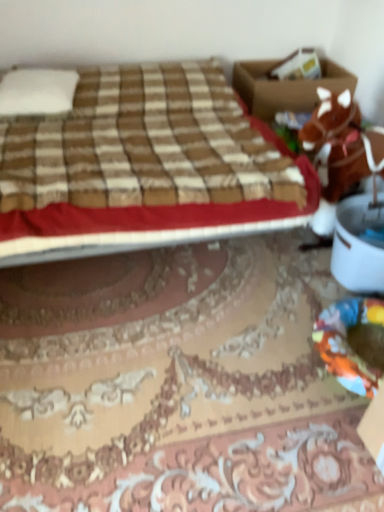
Question: Is brown plaid bed at upper left inside or outside of brown cardboard box at upper right?

Choices:
 (A) inside
 (B) outside

Answer: (B)

Question: Is brown plaid bed at upper left bigger or smaller than brown cardboard box at upper right?

Choices:
 (A) small
 (B) big

Answer: (B)

Question: Which object is positioned closest to the brown cardboard box at upper right?

Choices:
 (A) brown plush horse at right
 (B) brown plaid bed at upper left
 (C) white soft pillow at upper left

Answer: (A)

Question: Considering the real-world distances, which object is farthest from the brown plaid bed at upper left?

Choices:
 (A) brown cardboard box at upper right
 (B) white soft pillow at upper left
 (C) brown plush horse at right

Answer: (A)